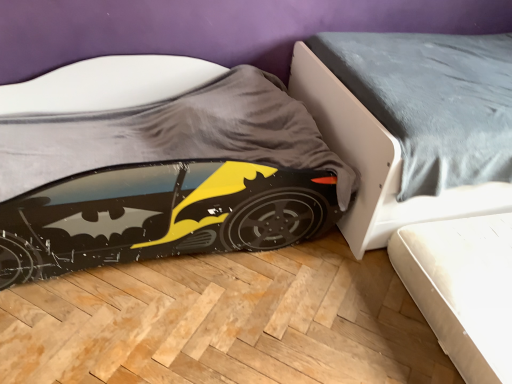
Image resolution: width=512 pixels, height=384 pixels. What do you see at coordinates (173, 134) in the screenshot?
I see `matt black batmobile at lower left` at bounding box center [173, 134].

Locate an element on the screen. The image size is (512, 384). matt black batmobile at lower left is located at coordinates (173, 134).

The width and height of the screenshot is (512, 384). Describe the element at coordinates (376, 162) in the screenshot. I see `smooth gray bed at lower right` at that location.

Image resolution: width=512 pixels, height=384 pixels. Find the location of `smooth gray bed at lower right`. smooth gray bed at lower right is located at coordinates (376, 162).

At what (x,y) coordinates should I click in order to perform the action: click on matt black batmobile at lower left. Please return your answer as a coordinate pair (x, y). Looking at the image, I should click on (173, 134).

Can you confirm if matt black batmobile at lower left is positioned to the left of smooth gray bed at lower right?

Correct, you'll find matt black batmobile at lower left to the left of smooth gray bed at lower right.

Which is behind, matt black batmobile at lower left or smooth gray bed at lower right?

Positioned behind is smooth gray bed at lower right.

Is point (160, 138) closer or farther from the camera than point (486, 185)?

Point (160, 138).

From the image's perspective, is matt black batmobile at lower left above or below smooth gray bed at lower right?

From the image's perspective, matt black batmobile at lower left appears below smooth gray bed at lower right.

From a real-world perspective, between matt black batmobile at lower left and smooth gray bed at lower right, who is vertically lower?

From a 3D spatial view, matt black batmobile at lower left is below.

Considering the sizes of objects matt black batmobile at lower left and smooth gray bed at lower right in the image provided, who is wider, matt black batmobile at lower left or smooth gray bed at lower right?

smooth gray bed at lower right.

Considering the relative sizes of matt black batmobile at lower left and smooth gray bed at lower right in the image provided, is matt black batmobile at lower left shorter than smooth gray bed at lower right?

Correct, matt black batmobile at lower left is not as tall as smooth gray bed at lower right.

Based on their sizes in the image, would you say matt black batmobile at lower left is bigger or smaller than smooth gray bed at lower right?

matt black batmobile at lower left is smaller than smooth gray bed at lower right.

Can we say matt black batmobile at lower left lies outside smooth gray bed at lower right?

Indeed, matt black batmobile at lower left is completely outside smooth gray bed at lower right.

Consider the image. Is matt black batmobile at lower left touching smooth gray bed at lower right?

No, matt black batmobile at lower left is not touching smooth gray bed at lower right.

Consider the image. Is matt black batmobile at lower left positioned with its back to smooth gray bed at lower right?

That's not correct — matt black batmobile at lower left is not looking away from smooth gray bed at lower right.

How different are the orientations of matt black batmobile at lower left and smooth gray bed at lower right in degrees?

The angular difference between matt black batmobile at lower left and smooth gray bed at lower right is 0.000115 degrees.

Where is `sheet on the left of smooth gray bed at lower right`? sheet on the left of smooth gray bed at lower right is located at coordinates (173, 134).

Is smooth gray bed at lower right at the left side of matt black batmobile at lower left?

Incorrect, smooth gray bed at lower right is not on the left side of matt black batmobile at lower left.

Between smooth gray bed at lower right and matt black batmobile at lower left, which one is positioned behind?

smooth gray bed at lower right is more distant.

Which is less distant, [357,199] or [65,126]?

Point [357,199] appears to be closer to the viewer than point [65,126].

From the image's perspective, who appears lower, smooth gray bed at lower right or matt black batmobile at lower left?

From the image's view, matt black batmobile at lower left is below.

Looking at this image, from a real-world perspective, is smooth gray bed at lower right above or below matt black batmobile at lower left?

smooth gray bed at lower right is above matt black batmobile at lower left.

Is smooth gray bed at lower right thinner than matt black batmobile at lower left?

No.

Considering the relative sizes of smooth gray bed at lower right and matt black batmobile at lower left in the image provided, is smooth gray bed at lower right shorter than matt black batmobile at lower left?

Incorrect, the height of smooth gray bed at lower right does not fall short of that of matt black batmobile at lower left.

Considering the sizes of smooth gray bed at lower right and matt black batmobile at lower left in the image, is smooth gray bed at lower right bigger or smaller than matt black batmobile at lower left?

Clearly, smooth gray bed at lower right is larger in size than matt black batmobile at lower left.

Is smooth gray bed at lower right outside of matt black batmobile at lower left?

Yes, smooth gray bed at lower right is outside of matt black batmobile at lower left.

In the scene shown: Are smooth gray bed at lower right and matt black batmobile at lower left located far from each other?

No, smooth gray bed at lower right is not far away from matt black batmobile at lower left.

Could you tell me if smooth gray bed at lower right is facing matt black batmobile at lower left?

No.

Locate an element on the screen. This screenshot has width=512, height=384. sheet in front of the smooth gray bed at lower right is located at coordinates [x=173, y=134].

Find the location of a particular element. Image resolution: width=512 pixels, height=384 pixels. bed that appears above the matt black batmobile at lower left (from a real-world perspective) is located at coordinates (376, 162).

This screenshot has width=512, height=384. What are the coordinates of `sheet below the smooth gray bed at lower right (from the image's perspective)` in the screenshot? It's located at (173, 134).